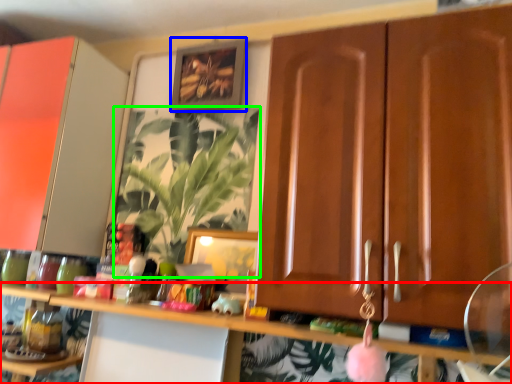
Question: Considering the real-world distances, which object is farthest from shelf (highlighted by a red box)? picture frame (highlighted by a blue box) or houseplant (highlighted by a green box)?

Choices:
 (A) picture frame
 (B) houseplant

Answer: (A)